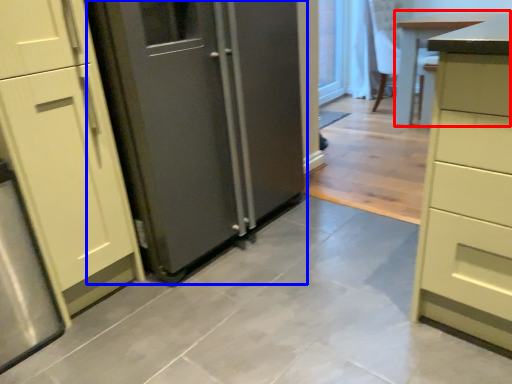
Question: Which of the following is the closest to the observer, table (highlighted by a red box) or door (highlighted by a blue box)?

Choices:
 (A) table
 (B) door

Answer: (B)